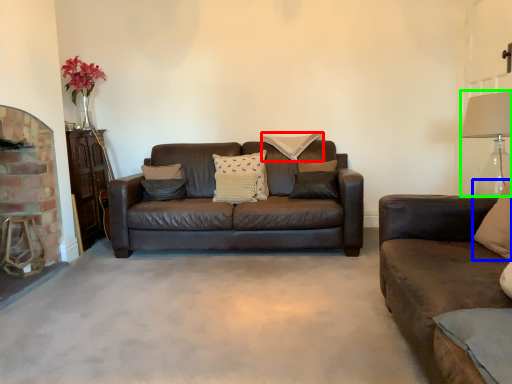
Question: Which object is positioned closest to pillow (highlighted by a red box)? Select from pillow (highlighted by a blue box) and table lamp (highlighted by a green box).

Choices:
 (A) pillow
 (B) table lamp

Answer: (B)